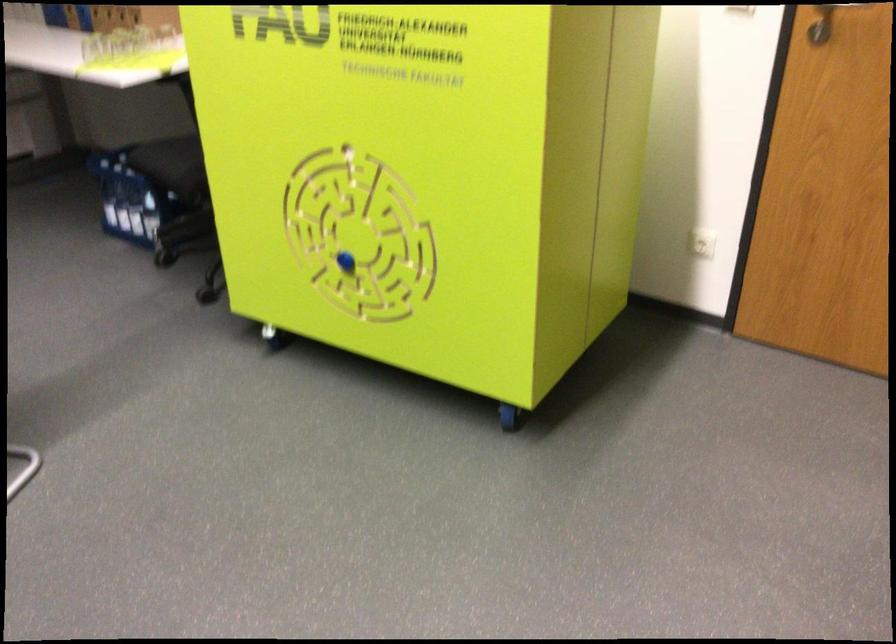
Where would you slid the blue maze knob? Please return your answer as a coordinate pair (x, y).

(346, 261)